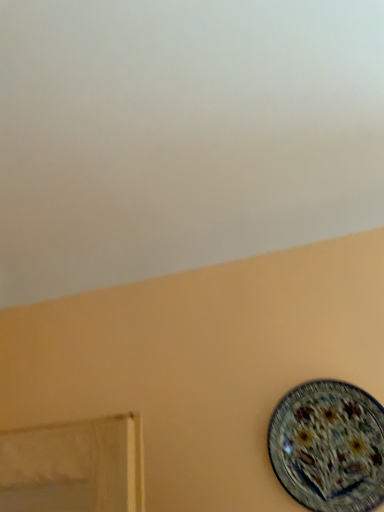
What do you see at coordinates (329, 447) in the screenshot? I see `decorative ceramic plate at lower right` at bounding box center [329, 447].

Image resolution: width=384 pixels, height=512 pixels. I want to click on decorative ceramic plate at lower right, so point(329,447).

Locate an element on the screen. Image resolution: width=384 pixels, height=512 pixels. decorative ceramic plate at lower right is located at coordinates (329, 447).